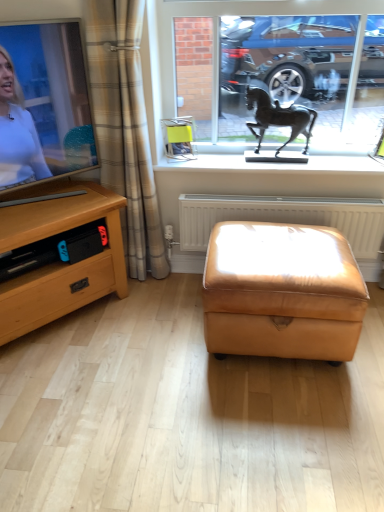
The height and width of the screenshot is (512, 384). Find the location of `blank space to the left of saddle brown leather ottoman at center`. blank space to the left of saddle brown leather ottoman at center is located at coordinates (155, 346).